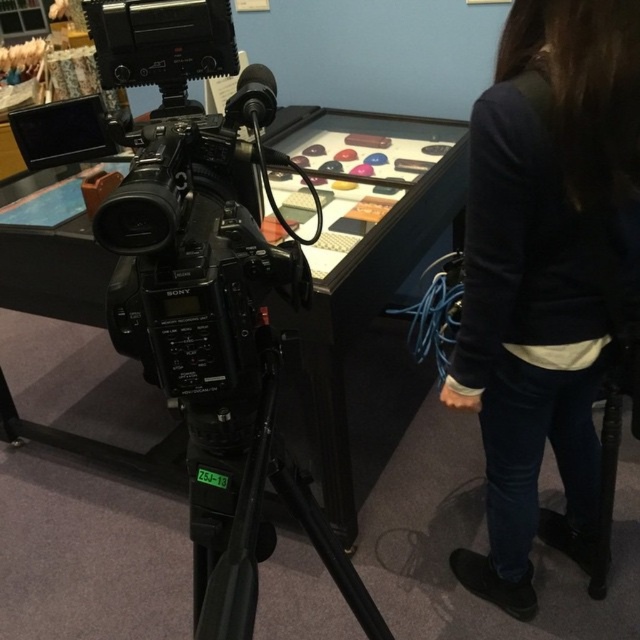
You are an assistant in a museum and need to place a small decorative item between the dark blue sweater at upper right and the black matte tripod at center. Considering their sizes, which object should the item be placed closer to?

The dark blue sweater at upper right has a larger size compared to the black matte tripod at center, so the item should be placed closer to the black matte tripod at center to balance the space.

You are standing in the museum and want to take a photo of the display case. The camera is at point (x=579, y=394) and the display case is at point (x=240, y=564). Which point should you move towards to get a better view of the display case?

You should move towards point (x=240, y=564) because it is closer to the display case and in front of point (x=579, y=394), allowing for a better view.

You are a photographer setting up equipment in the museum. You need to position a new light stand between the dark blue sweater at upper right and the black matte tripod at center. Based on their positions, where should you place the light stand?

The dark blue sweater at upper right is to the right of the black matte tripod at center, so you should place the light stand to the left of the dark blue sweater at upper right and to the right of the black matte tripod at center.